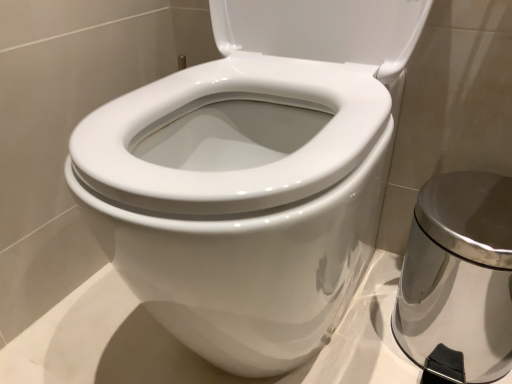
Question: Is white glossy bidet at center facing away from satin silver trash can at right?

Choices:
 (A) no
 (B) yes

Answer: (A)

Question: Would you say white glossy bidet at center is a long distance from satin silver trash can at right?

Choices:
 (A) yes
 (B) no

Answer: (B)

Question: From a real-world perspective, is white glossy bidet at center beneath satin silver trash can at right?

Choices:
 (A) no
 (B) yes

Answer: (A)

Question: Is white glossy bidet at center wider than satin silver trash can at right?

Choices:
 (A) no
 (B) yes

Answer: (B)

Question: Does white glossy bidet at center have a lesser height compared to satin silver trash can at right?

Choices:
 (A) no
 (B) yes

Answer: (A)

Question: Considering the relative sizes of white glossy bidet at center and satin silver trash can at right in the image provided, is white glossy bidet at center thinner than satin silver trash can at right?

Choices:
 (A) no
 (B) yes

Answer: (A)

Question: Does satin silver trash can at right have a lesser width compared to white glossy bidet at center?

Choices:
 (A) no
 (B) yes

Answer: (B)

Question: Can we say satin silver trash can at right lies outside white glossy bidet at center?

Choices:
 (A) yes
 (B) no

Answer: (A)

Question: Is satin silver trash can at right touching white glossy bidet at center?

Choices:
 (A) yes
 (B) no

Answer: (B)

Question: From a real-world perspective, is satin silver trash can at right beneath white glossy bidet at center?

Choices:
 (A) yes
 (B) no

Answer: (A)

Question: From the image's perspective, does satin silver trash can at right appear higher than white glossy bidet at center?

Choices:
 (A) no
 (B) yes

Answer: (A)

Question: Is the position of satin silver trash can at right more distant than that of white glossy bidet at center?

Choices:
 (A) yes
 (B) no

Answer: (A)

Question: Is point (346, 226) positioned closer to the camera than point (467, 327)?

Choices:
 (A) farther
 (B) closer

Answer: (B)